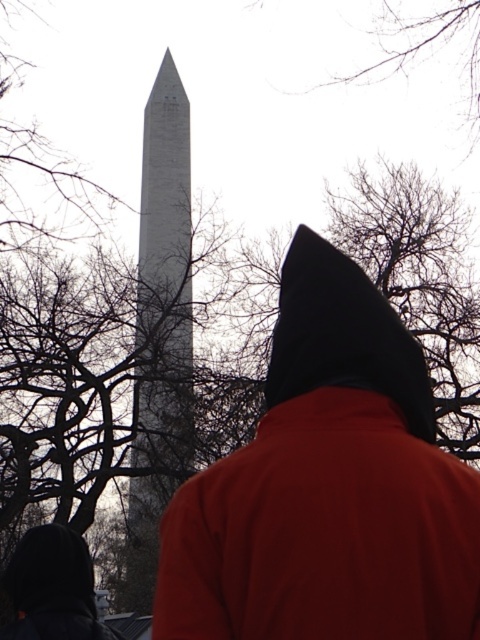
Question: Can you confirm if matte black hood at center is wider than white stone tower at center?

Choices:
 (A) no
 (B) yes

Answer: (B)

Question: Is matte black hood at center wider than white stone tower at center?

Choices:
 (A) no
 (B) yes

Answer: (B)

Question: Which point is farther from the camera taking this photo?

Choices:
 (A) (166, 339)
 (B) (267, 380)

Answer: (A)

Question: Can you confirm if matte black hood at center is positioned above white stone tower at center?

Choices:
 (A) no
 (B) yes

Answer: (A)